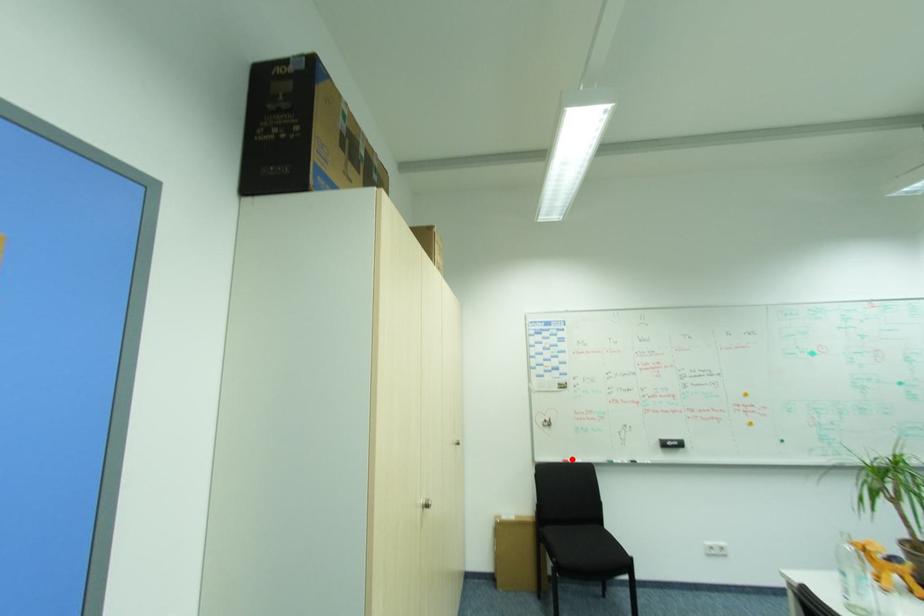
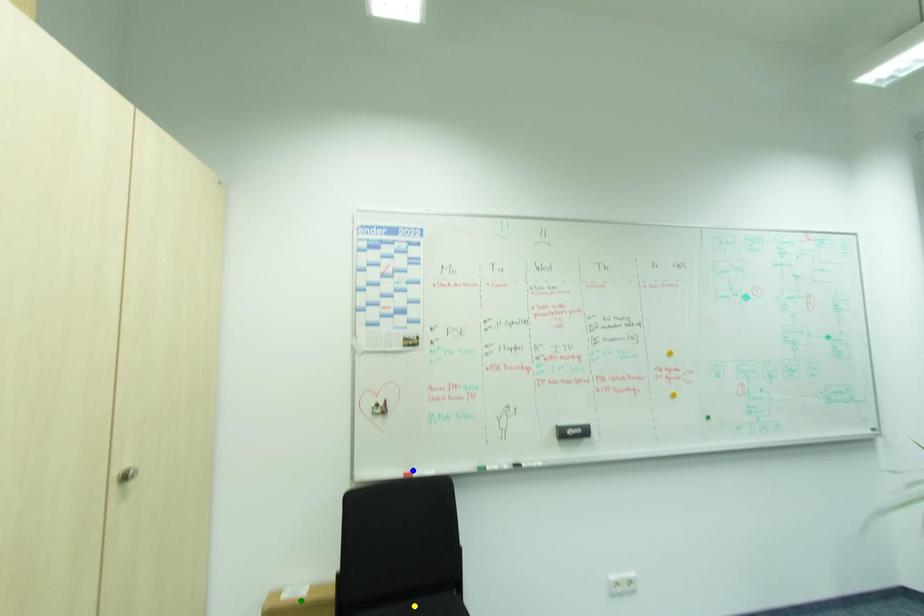
Question: I am providing you with two images of the same scene from different viewpoints. A red point is marked on the first image. You are given multiple points on the second image. Which point in image 2 represents the same 3d spot as the red point in image 1?

Choices:
 (A) yellow point
 (B) green point
 (C) blue point

Answer: (C)